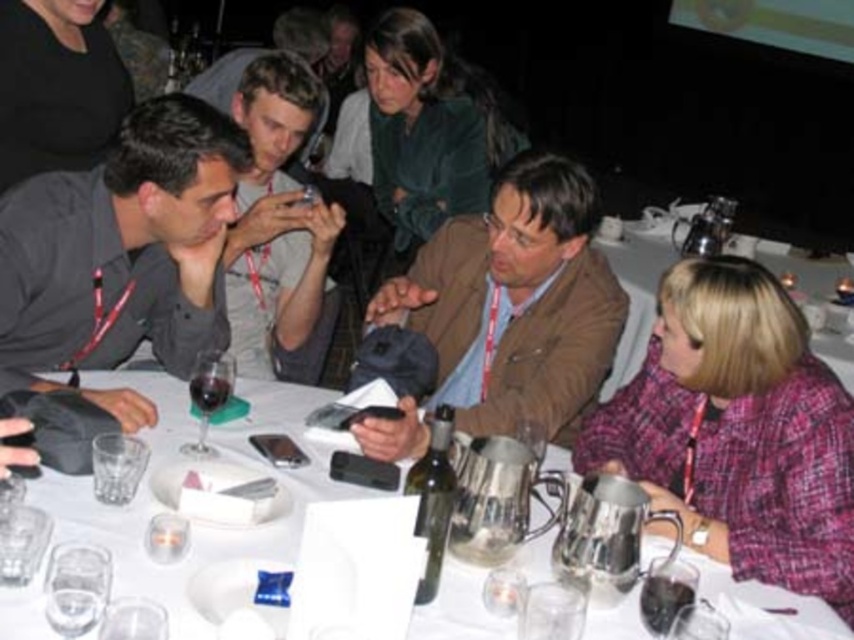
Can you confirm if pink tweed jacket at lower right is thinner than metallic silver wine at center?

Yes, pink tweed jacket at lower right is thinner than metallic silver wine at center.

Measure the distance between point (x=717, y=417) and camera.

Point (x=717, y=417) and camera are 5.81 feet apart from each other.

Where is `pink tweed jacket at lower right`? The height and width of the screenshot is (640, 854). pink tweed jacket at lower right is located at coordinates (738, 429).

Identify the location of pink tweed jacket at lower right. (738, 429).

How much distance is there between matte black shirt at left and transparent glass at lower left?

matte black shirt at left and transparent glass at lower left are 28.27 inches apart from each other.

Does point (44, 349) lie in front of point (79, 598)?

No, (44, 349) is further to viewer.

Locate an element on the screen. matte black shirt at left is located at coordinates (121, 248).

Locate an element on the screen. matte black shirt at left is located at coordinates [121, 248].

Consider the image. Between matte black shirt at left and brown leather jacket at center, which one appears on the left side from the viewer's perspective?

Positioned to the left is matte black shirt at left.

Between point (179, 216) and point (542, 252), which one is positioned behind?

The point (542, 252) is behind.

Measure the distance between matte black shirt at left and camera.

5.27 feet

Where is `matte black shirt at left`? The width and height of the screenshot is (854, 640). matte black shirt at left is located at coordinates (121, 248).